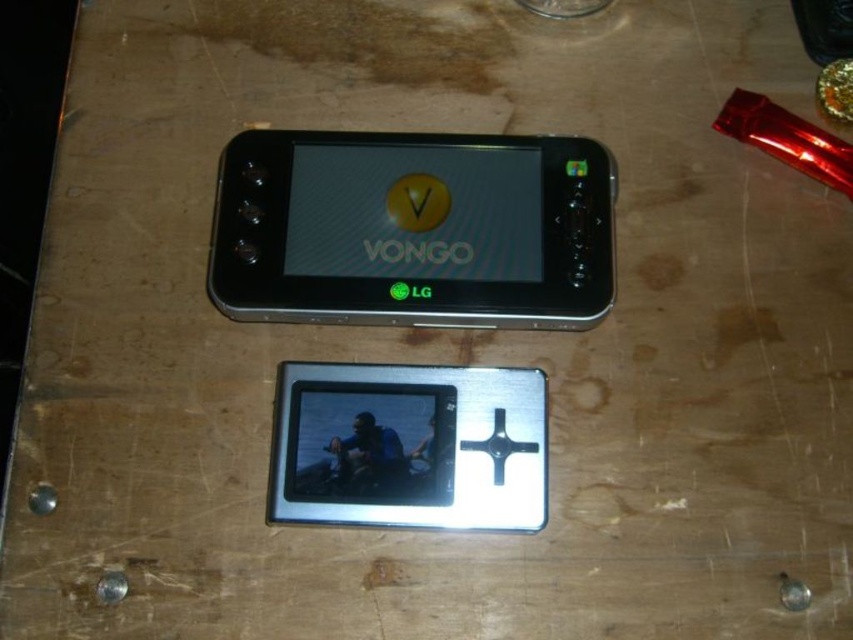
Question: Does matte black phone at center appear over silver metallic media player at center?

Choices:
 (A) yes
 (B) no

Answer: (A)

Question: Does matte black phone at center appear on the right side of silver metallic media player at center?

Choices:
 (A) yes
 (B) no

Answer: (A)

Question: Which of the following is the farthest from the observer?

Choices:
 (A) matte black phone at center
 (B) silver metallic media player at center

Answer: (A)

Question: Which point is closer to the camera taking this photo?

Choices:
 (A) (234, 202)
 (B) (418, 472)

Answer: (B)

Question: Is matte black phone at center positioned at the back of silver metallic media player at center?

Choices:
 (A) yes
 (B) no

Answer: (A)